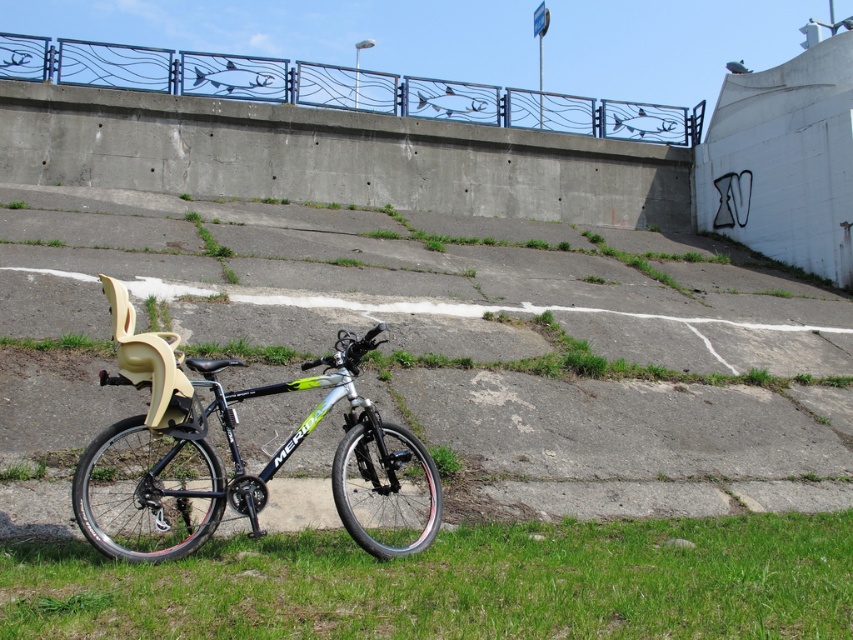
Does green grass at lower center lie in front of blue metal rail at upper center?

Yes, it is.

Between green grass at lower center and blue metal rail at upper center, which one has less height?

green grass at lower center is shorter.

Is point (746, 554) farther from camera compared to point (20, 60)?

No.

You are a GUI agent. You are given a task and a screenshot of the screen. Output one action in this format:
    pyautogui.click(x=<x>, y=<y>)
    Task: Click on the green grass at lower center
    The image size is (853, 640).
    Given the screenshot: What is the action you would take?
    pyautogui.click(x=456, y=582)

The image size is (853, 640). What do you see at coordinates (456, 582) in the screenshot? I see `green grass at lower center` at bounding box center [456, 582].

Between point (172, 600) and point (200, 532), which one is positioned behind?

The point (200, 532) is more distant.

The width and height of the screenshot is (853, 640). I want to click on green grass at lower center, so click(x=456, y=582).

Does silver metallic bicycle at center appear on the left side of blue metal rail at upper center?

Correct, you'll find silver metallic bicycle at center to the left of blue metal rail at upper center.

Which is more to the left, silver metallic bicycle at center or blue metal rail at upper center?

silver metallic bicycle at center

Is point (392, 449) behind point (177, 90)?

No, (392, 449) is closer to viewer.

Image resolution: width=853 pixels, height=640 pixels. I want to click on silver metallic bicycle at center, so click(241, 458).